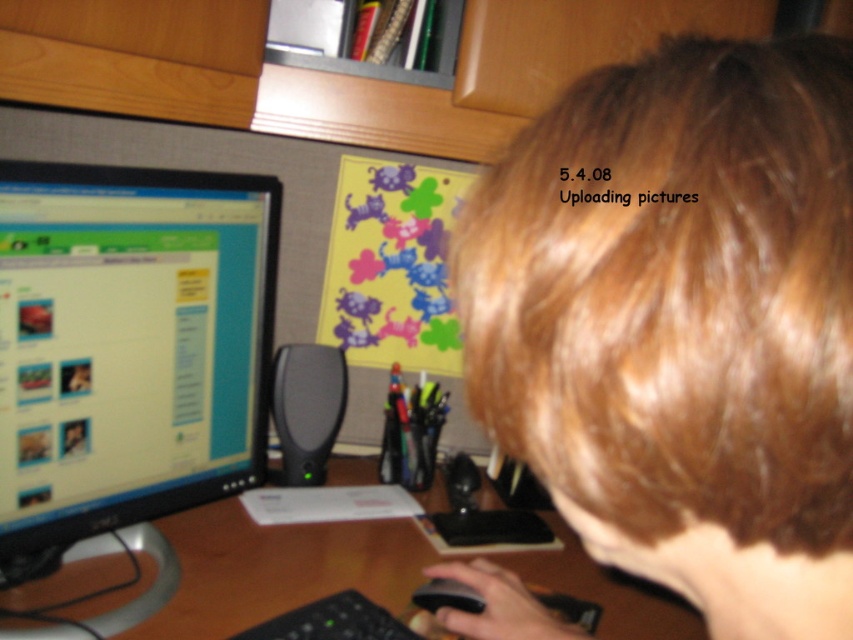
Question: Which object is farther from the camera taking this photo?

Choices:
 (A) black glossy monitor at left
 (B) black plastic mouse at lower center

Answer: (B)

Question: Can you confirm if wooden at center is wider than black plastic mouse at lower center?

Choices:
 (A) yes
 (B) no

Answer: (A)

Question: Which of the following is the farthest from the observer?

Choices:
 (A) black glossy monitor at left
 (B) brown hair at upper right

Answer: (A)

Question: Which is farther from the black plastic mouse at lower center?

Choices:
 (A) brown hair at upper right
 (B) wooden at center

Answer: (A)

Question: Does brown hair at upper right come in front of black glossy monitor at left?

Choices:
 (A) yes
 (B) no

Answer: (A)

Question: Can you confirm if black glossy monitor at left is positioned to the left of black plastic mouse at lower center?

Choices:
 (A) yes
 (B) no

Answer: (A)